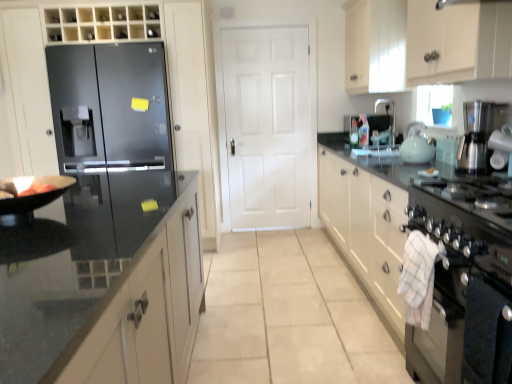
Measure the distance between point (424, 73) and camera.

Point (424, 73) and camera are 2.26 meters apart.

What is the approximate height of glossy black refrigerator at left, the 3th cabinetry when ordered from right to left?

The height of glossy black refrigerator at left, the 3th cabinetry when ordered from right to left, is 7.16 feet.

The width and height of the screenshot is (512, 384). What do you see at coordinates (484, 136) in the screenshot? I see `satin silver coffee maker at right, marked as the first appliance in a front-to-back arrangement` at bounding box center [484, 136].

What do you see at coordinates (267, 124) in the screenshot? This screenshot has width=512, height=384. I see `white matte door at center` at bounding box center [267, 124].

At what (x,y) coordinates should I click in order to perform the action: click on white glossy cabinet at upper right, positioned as the second cabinetry in left-to-right order. Please return your answer as a coordinate pair (x, y). This screenshot has height=384, width=512. Looking at the image, I should click on (458, 41).

Looking at this image, is white glossy cabinet at right, which is the 1th cabinetry from right to left, outside of satin black refrigerator at left?

Yes, white glossy cabinet at right, which is the 1th cabinetry from right to left, is not within satin black refrigerator at left.

Considering the relative sizes of white glossy cabinet at right, the third cabinetry from the left, and satin black refrigerator at left in the image provided, is white glossy cabinet at right, the third cabinetry from the left, bigger than satin black refrigerator at left?

Correct, white glossy cabinet at right, the third cabinetry from the left, is larger in size than satin black refrigerator at left.

Does white glossy cabinet at right, the third cabinetry from the left, appear on the right side of satin black refrigerator at left?

Yes, white glossy cabinet at right, the third cabinetry from the left, is to the right of satin black refrigerator at left.

Is white glossy cabinet at right, the third cabinetry from the left, with satin black refrigerator at left?

white glossy cabinet at right, the third cabinetry from the left, and satin black refrigerator at left are clearly separated.

From a real-world perspective, is white glossy sink at upper right positioned above or below glossy black refrigerator at left, the 3th cabinetry when ordered from right to left?

From a real-world perspective, white glossy sink at upper right is physically above glossy black refrigerator at left, the 3th cabinetry when ordered from right to left.

Considering the sizes of objects white glossy sink at upper right and glossy black refrigerator at left, which is counted as the 1th cabinetry, starting from the left, in the image provided, who is smaller, white glossy sink at upper right or glossy black refrigerator at left, which is counted as the 1th cabinetry, starting from the left,?

white glossy sink at upper right.

Between white glossy sink at upper right and glossy black refrigerator at left, the 3th cabinetry when ordered from right to left, which one appears on the right side from the viewer's perspective?

white glossy sink at upper right.

Is white glossy cabinet at right, which is the 1th cabinetry from right to left, at the back of satin silver coffee maker at right, the second appliance when ordered from back to front?

satin silver coffee maker at right, the second appliance when ordered from back to front, is not turned away from white glossy cabinet at right, which is the 1th cabinetry from right to left.

Which of these two, satin silver coffee maker at right, which appears as the 2th appliance when viewed from the top, or white glossy cabinet at right, the third cabinetry from the left, is wider?

Wider between the two is white glossy cabinet at right, the third cabinetry from the left.

Considering the relative positions of satin silver coffee maker at right, marked as the first appliance in a front-to-back arrangement, and white glossy cabinet at right, the third cabinetry from the left, in the image provided, is satin silver coffee maker at right, marked as the first appliance in a front-to-back arrangement, to the left or to the right of white glossy cabinet at right, the third cabinetry from the left,?

From the image, it's evident that satin silver coffee maker at right, marked as the first appliance in a front-to-back arrangement, is to the right of white glossy cabinet at right, the third cabinetry from the left.

From a real-world perspective, count 2nd appliances upward from the white glossy cabinet at right, which is the 1th cabinetry from right to left, and point to it. Please provide its 2D coordinates.

[(484, 136)]

Who is smaller, white glossy sink at upper right or satin black refrigerator at left?

With smaller size is white glossy sink at upper right.

From their relative heights in the image, would you say white glossy sink at upper right is taller or shorter than satin black refrigerator at left?

In the image, white glossy sink at upper right appears to be shorter than satin black refrigerator at left.

From the image's perspective, is white glossy sink at upper right above or below satin black refrigerator at left?

Based on their image positions, white glossy sink at upper right is located above satin black refrigerator at left.

Locate an element on the screen. refrigerator in front of the white glossy sink at upper right is located at coordinates (112, 142).

Measure the distance from white matte door at center to glossy black refrigerator at left, the 3th cabinetry when ordered from right to left.

white matte door at center and glossy black refrigerator at left, the 3th cabinetry when ordered from right to left, are 36.39 inches apart from each other.

From a real-world perspective, count 1st cabinetrys upward from the white matte door at center and point to it. Please provide its 2D coordinates.

[(113, 203)]

Is the surface of white matte door at center in direct contact with glossy black refrigerator at left, the 3th cabinetry when ordered from right to left?

white matte door at center is not next to glossy black refrigerator at left, the 3th cabinetry when ordered from right to left, and they're not touching.

Is glossy black refrigerator at left, the 3th cabinetry when ordered from right to left, completely or partially inside white matte door at center?

No.

From the image's perspective, is white glossy cabinet at upper right, positioned as the second cabinetry in left-to-right order, above white glossy sink at upper right?

Indeed, from the image's perspective, white glossy cabinet at upper right, positioned as the second cabinetry in left-to-right order, is shown above white glossy sink at upper right.

Considering the positions of objects white glossy cabinet at upper right, positioned as the second cabinetry in left-to-right order, and white glossy sink at upper right in the image provided, who is in front, white glossy cabinet at upper right, positioned as the second cabinetry in left-to-right order, or white glossy sink at upper right?

white glossy cabinet at upper right, positioned as the second cabinetry in left-to-right order.

Considering the sizes of objects white glossy cabinet at upper right, which ranks as the 2th cabinetry in right-to-left order, and white glossy sink at upper right in the image provided, who is wider, white glossy cabinet at upper right, which ranks as the 2th cabinetry in right-to-left order, or white glossy sink at upper right?

Wider between the two is white glossy cabinet at upper right, which ranks as the 2th cabinetry in right-to-left order.

Does white glossy cabinet at upper right, positioned as the second cabinetry in left-to-right order, have a smaller size compared to white glossy sink at upper right?

Actually, white glossy cabinet at upper right, positioned as the second cabinetry in left-to-right order, might be larger than white glossy sink at upper right.

Considering the points (446, 303) and (366, 78), which point is in front, point (446, 303) or point (366, 78)?

The point (446, 303) is in front.

Can you tell me how much black stainless steel oven at lower right and white glossy cabinet at upper right, positioned as the second cabinetry in left-to-right order, differ in facing direction?

black stainless steel oven at lower right and white glossy cabinet at upper right, positioned as the second cabinetry in left-to-right order, are facing 0.907 degrees away from each other.

Would you say black stainless steel oven at lower right is inside or outside white glossy cabinet at upper right, positioned as the second cabinetry in left-to-right order?

black stainless steel oven at lower right exists outside the volume of white glossy cabinet at upper right, positioned as the second cabinetry in left-to-right order.

Is black stainless steel oven at lower right to the left of white glossy cabinet at upper right, positioned as the second cabinetry in left-to-right order, from the viewer's perspective?

In fact, black stainless steel oven at lower right is to the right of white glossy cabinet at upper right, positioned as the second cabinetry in left-to-right order.

The height and width of the screenshot is (384, 512). Identify the location of the 2nd cabinetry in front of the satin black refrigerator at left. (436, 262).

The image size is (512, 384). I want to click on sink located on the right of glossy black refrigerator at left, which is counted as the 1th cabinetry, starting from the left, so click(376, 132).

Estimate the real-world distances between objects in this image. Which object is closer to white glossy cabinet at upper right, positioned as the second cabinetry in left-to-right order, black stainless steel oven at lower right or white matte door at center?

Based on the image, black stainless steel oven at lower right appears to be nearer to white glossy cabinet at upper right, positioned as the second cabinetry in left-to-right order.

Looking at the image, which one is located closer to glossy black refrigerator at left, the 3th cabinetry when ordered from right to left, black stainless steel oven at lower right or white matte door at center?

white matte door at center lies closer to glossy black refrigerator at left, the 3th cabinetry when ordered from right to left, than the other object.

From the image, which object appears to be nearer to satin silver coffee maker at right, which appears as the 2th appliance when viewed from the top, glossy black refrigerator at left, the 3th cabinetry when ordered from right to left, or light blue glass tea pot at right?

light blue glass tea pot at right.

Considering their positions, is satin black refrigerator at left positioned closer to translucent glass soap dispenser at upper right, which is counted as the 2th appliance, starting from the front, than white matte door at center?

The object closer to translucent glass soap dispenser at upper right, which is counted as the 2th appliance, starting from the front, is white matte door at center.

Considering their positions, is translucent glass soap dispenser at upper right, acting as the first appliance starting from the back, positioned closer to white glossy cabinet at upper right, which ranks as the 2th cabinetry in right-to-left order, than white matte door at center?

Among the two, translucent glass soap dispenser at upper right, acting as the first appliance starting from the back, is located nearer to white glossy cabinet at upper right, which ranks as the 2th cabinetry in right-to-left order.

Which object lies further to the anchor point black stainless steel oven at lower right, light blue glass tea pot at right or white matte door at center?

Among the two, white matte door at center is located further to black stainless steel oven at lower right.

From the image, which object appears to be nearer to satin silver coffee maker at right, the second appliance when ordered from back to front, translucent glass soap dispenser at upper right, which appears as the first appliance when viewed from the top, or black stainless steel oven at lower right?

Based on the image, black stainless steel oven at lower right appears to be nearer to satin silver coffee maker at right, the second appliance when ordered from back to front.

Based on their spatial positions, is white glossy cabinet at upper right, positioned as the second cabinetry in left-to-right order, or white glossy cabinet at right, the third cabinetry from the left, closer to translucent glass soap dispenser at upper right, the 2th appliance from the bottom?

white glossy cabinet at upper right, positioned as the second cabinetry in left-to-right order, is closer to translucent glass soap dispenser at upper right, the 2th appliance from the bottom.

You are a GUI agent. You are given a task and a screenshot of the screen. Output one action in this format:
    pyautogui.click(x=<x>, y=<y>)
    Task: Click on the tea pot between glossy black refrigerator at left, the 3th cabinetry when ordered from right to left, and satin silver coffee maker at right, marked as the first appliance in a front-to-back arrangement
    The width and height of the screenshot is (512, 384).
    Given the screenshot: What is the action you would take?
    pyautogui.click(x=417, y=145)

Image resolution: width=512 pixels, height=384 pixels. What are the coordinates of `door situated between glossy black refrigerator at left, the 3th cabinetry when ordered from right to left, and light blue glass tea pot at right from left to right` in the screenshot? It's located at (267, 124).

Identify the location of refrigerator between glossy black refrigerator at left, which is counted as the 1th cabinetry, starting from the left, and light blue glass tea pot at right from left to right. The height and width of the screenshot is (384, 512). (112, 142).

At what (x,y) coordinates should I click in order to perform the action: click on appliance situated between glossy black refrigerator at left, the 3th cabinetry when ordered from right to left, and white glossy sink at upper right from left to right. Please return your answer as a coordinate pair (x, y). Looking at the image, I should click on (370, 130).